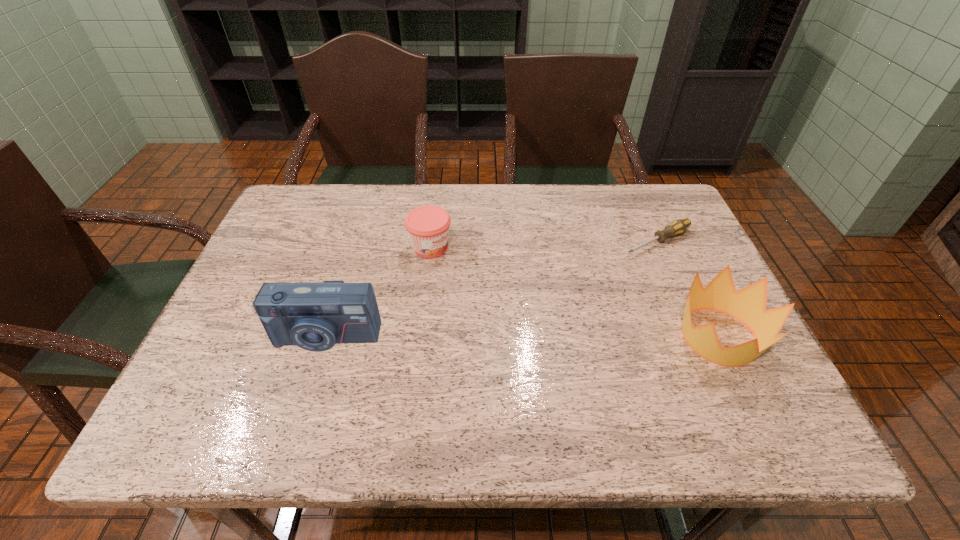
This screenshot has width=960, height=540. What are the coordinates of `free space located 0.180m at the tip of the shortest object` in the screenshot? It's located at (579, 276).

Identify the location of free space located at the tip of the shortest object. This screenshot has height=540, width=960. (582, 274).

Locate an element on the screen. Image resolution: width=960 pixels, height=540 pixels. jam located at the far edge is located at coordinates [428, 226].

Find the location of a particular element. The width and height of the screenshot is (960, 540). screwdriver that is at the far edge is located at coordinates (679, 226).

Locate an element on the screen. This screenshot has width=960, height=540. object that is at the near edge is located at coordinates (748, 305).

At what (x,y) coordinates should I click in order to perform the action: click on object positioned at the left edge. Please return your answer as a coordinate pair (x, y). Looking at the image, I should click on (x=314, y=316).

The width and height of the screenshot is (960, 540). What are the coordinates of `crown that is at the right edge` in the screenshot? It's located at (748, 305).

Locate an element on the screen. screwdriver present at the right edge is located at coordinates (679, 226).

At what (x,y) coordinates should I click in order to perform the action: click on object that is at the far right corner. Please return your answer as a coordinate pair (x, y). Looking at the image, I should click on (679, 226).

Where is `object that is at the near right corner`? The width and height of the screenshot is (960, 540). object that is at the near right corner is located at coordinates (748, 305).